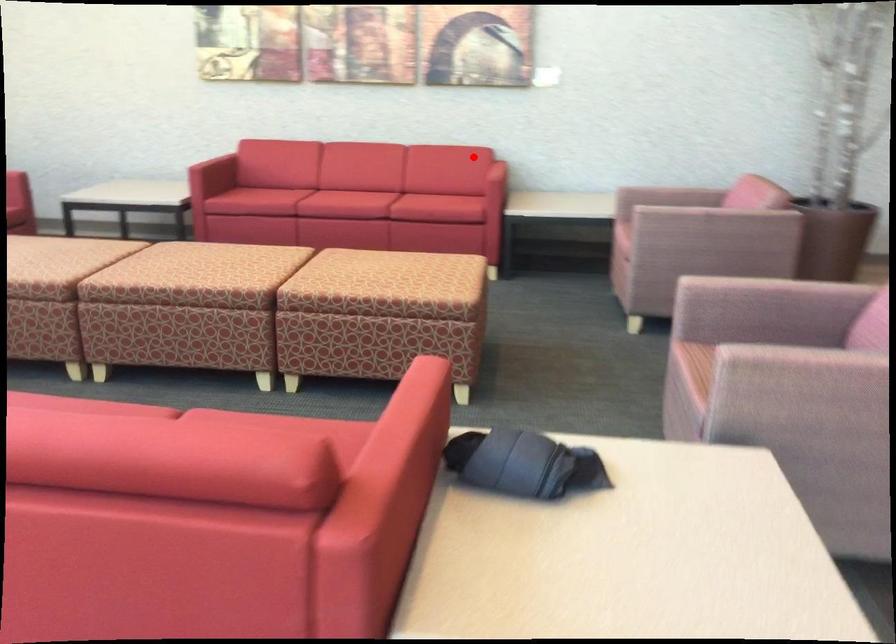
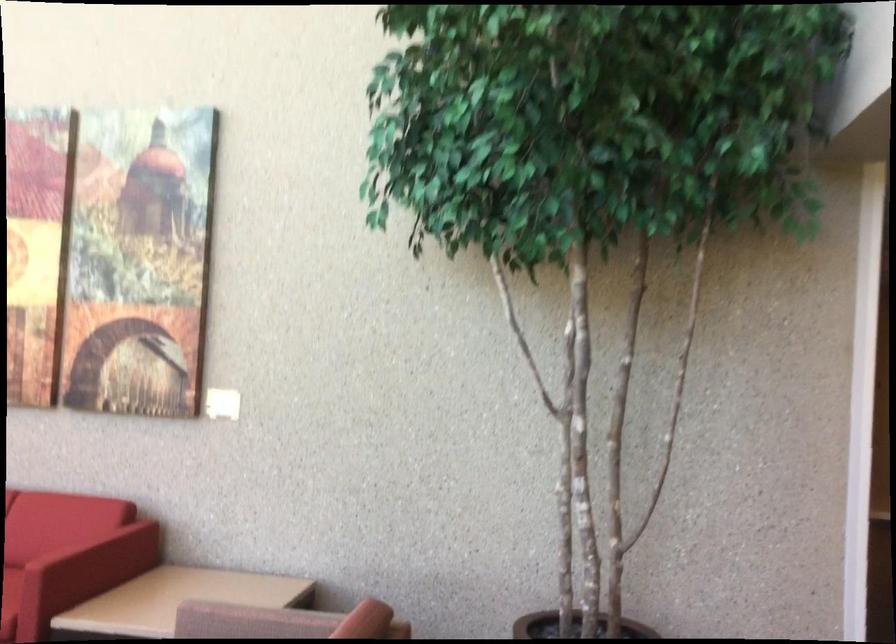
Question: A red point is marked in image1. In image2, is the corresponding 3D point closer to the camera or farther? Reply with the corresponding letter.

Choices:
 (A) The corresponding 3D point is closer.
 (B) The corresponding 3D point is farther.

Answer: (A)